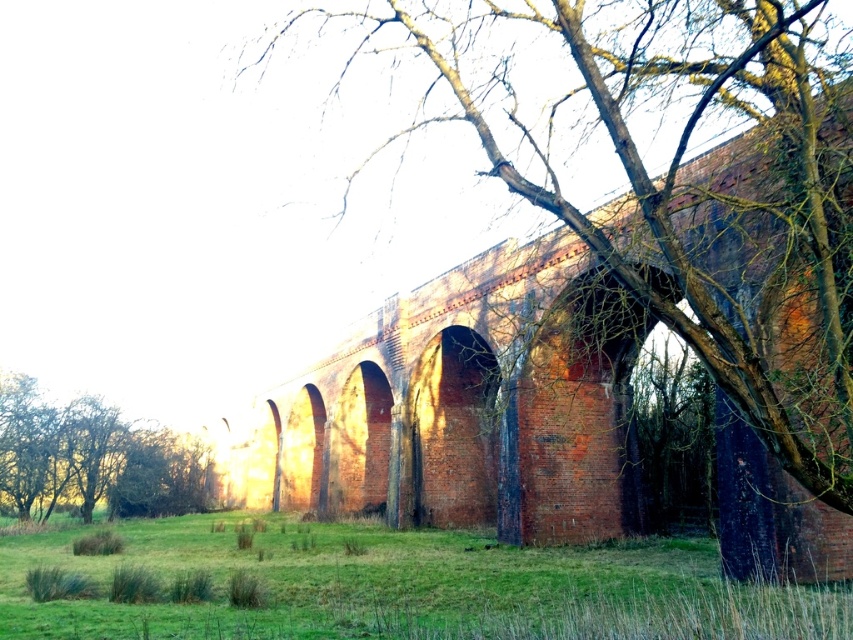
You are standing at the entrance of the viaduct and want to take a photo of the brown textured tree at center. Which direction should you face to capture the tree in your view?

The brown textured tree at center is located at point (606, 296), which is in the center of the image. To capture it, you should face towards the center of the viaduct where the tree is positioned.

You are standing at the base of the green leafy tree at lower left and want to walk towards the brown textured tree at center. Which direction should you head?

You should head to the right to reach the brown textured tree at center since it is positioned on the right side of the green leafy tree at lower left.

You are standing at the point marked as point (399, 586). Looking around, you see the brick viaduct with arches and a tree with bare branches. What is the immediate surface beneath your feet?

The immediate surface beneath your feet is the green grassy area at lower center, as the point (399, 586) is located on it.